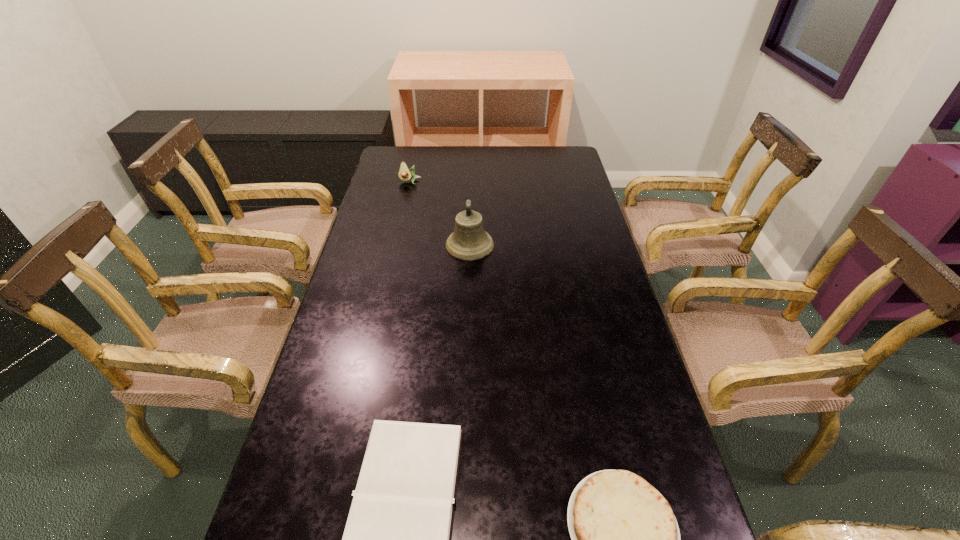
The width and height of the screenshot is (960, 540). I want to click on bell, so click(469, 241).

Find the location of a particular element. the tallest object is located at coordinates (469, 241).

The height and width of the screenshot is (540, 960). In order to click on avocado in this screenshot , I will do `click(405, 174)`.

At what (x,y) coordinates should I click in order to perform the action: click on the third shortest object. Please return your answer as a coordinate pair (x, y). This screenshot has width=960, height=540. Looking at the image, I should click on (405, 174).

The width and height of the screenshot is (960, 540). Identify the location of vacant region located on the front of the third nearest object. (467, 355).

You are a GUI agent. You are given a task and a screenshot of the screen. Output one action in this format:
    pyautogui.click(x=<x>, y=<y>)
    Task: Click on the free space located 0.110m on the seed side of the avocado
    
    Given the screenshot: What is the action you would take?
    pyautogui.click(x=406, y=200)

You are a GUI agent. You are given a task and a screenshot of the screen. Output one action in this format:
    pyautogui.click(x=<x>, y=<y>)
    Task: Click on the object that is at the left edge
    The width and height of the screenshot is (960, 540).
    Given the screenshot: What is the action you would take?
    pyautogui.click(x=405, y=174)

I want to click on free space at the far edge, so click(460, 154).

This screenshot has height=540, width=960. What are the coordinates of `vacant region at the left edge of the desktop` in the screenshot? It's located at (306, 420).

Identify the location of vacant area at the right edge of the desktop. (571, 255).